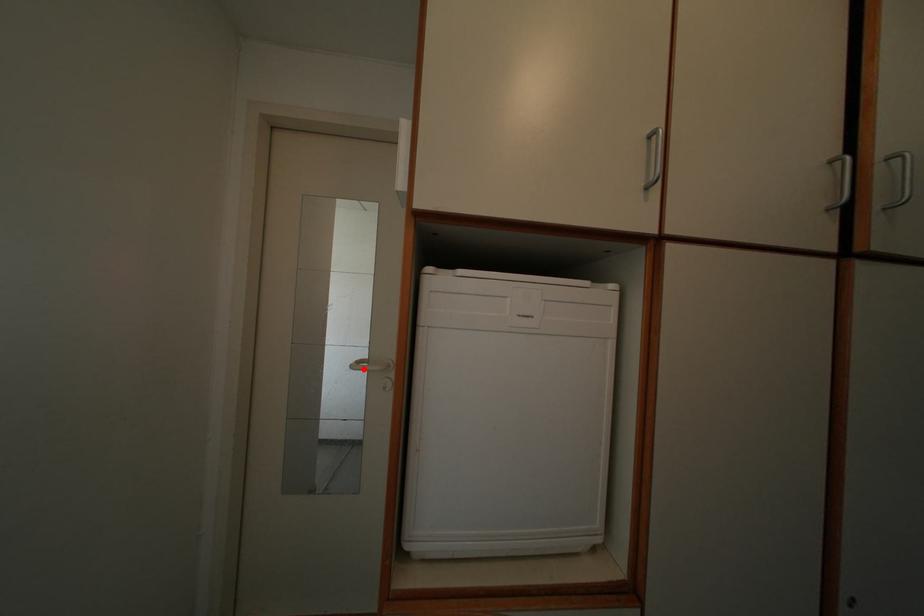
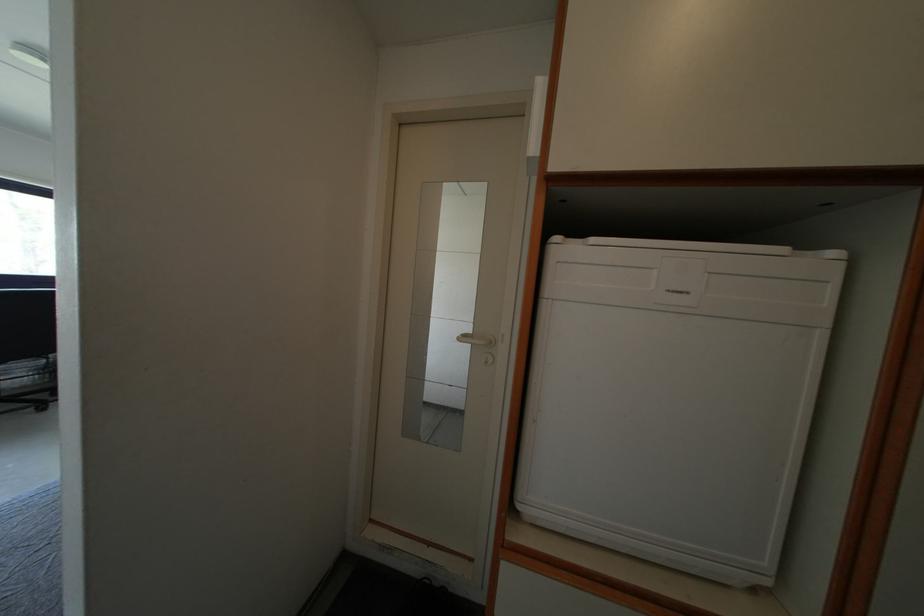
Locate, in the second image, the point that corresponds to the highlighted location in the first image.

(468, 342)